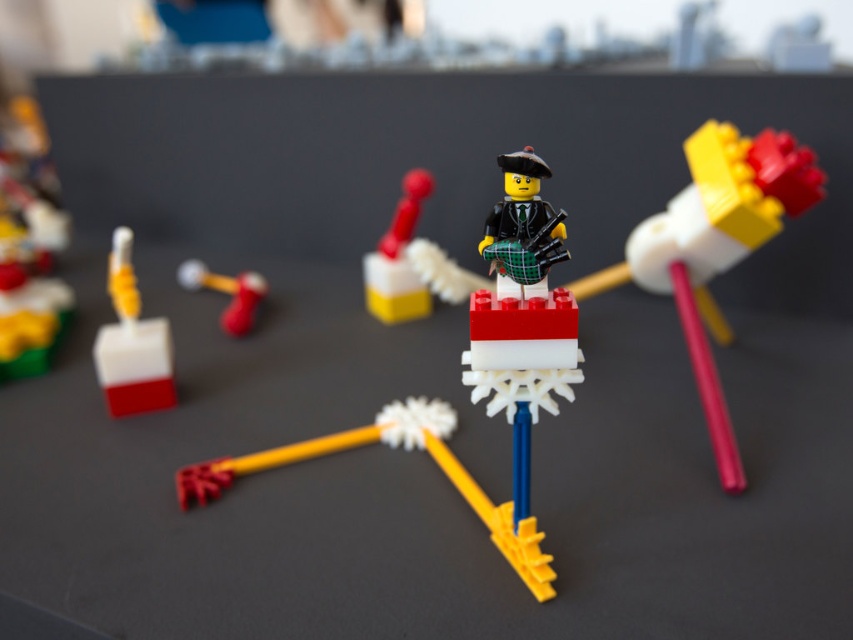
You have a 16 inch long LEGO connector piece. If you want to attach the white matte block at left to the smooth white block at center, will the connector be long enough?

The white matte block at left and smooth white block at center are 18.28 inches apart. The 16 inch connector is shorter than the distance between them, so it won not be long enough to connect them.

You are looking at the LEGO scene and want to place a new LEGO piece between the two points, point (595, 276) and point (397, 305). Which point should the new piece be closer to in order to maintain the depth perspective?

The new LEGO piece should be placed closer to point (595, 276) because it is closer to the viewer than point (397, 305), maintaining the depth perspective.